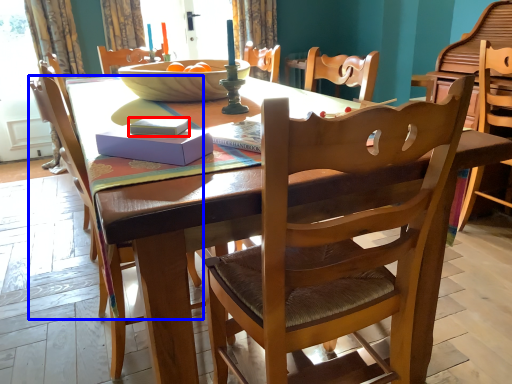
Question: Which object is closer to the camera taking this photo, book (highlighted by a red box) or chair (highlighted by a blue box)?

Choices:
 (A) book
 (B) chair

Answer: (A)